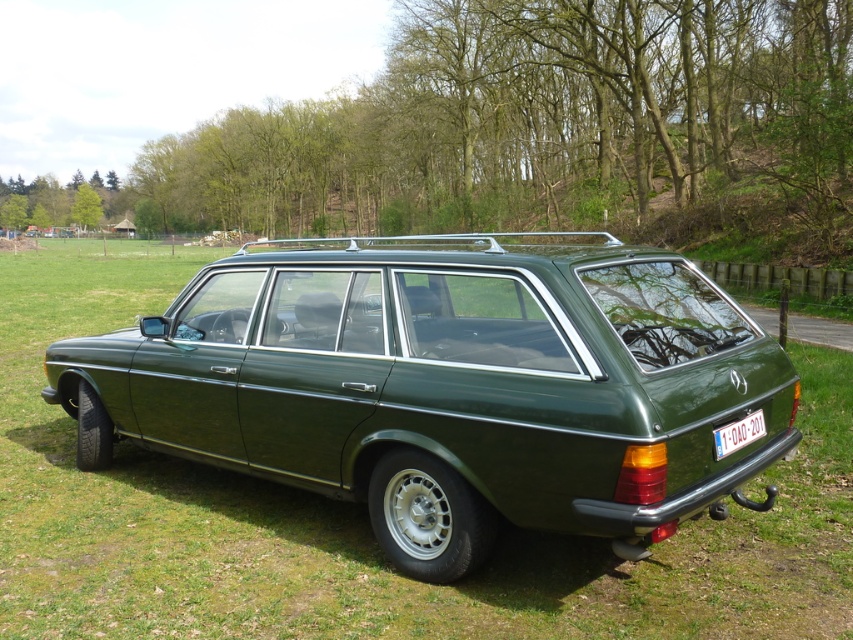
Question: Which point is closer to the camera?

Choices:
 (A) (242, 369)
 (B) (724, 444)

Answer: (B)

Question: Which point is closer to the camera?

Choices:
 (A) white plastic license plate at lower right
 (B) green matte station wagon at center

Answer: (B)

Question: Is green matte station wagon at center thinner than white plastic license plate at lower right?

Choices:
 (A) yes
 (B) no

Answer: (B)

Question: Which point is farther to the camera?

Choices:
 (A) white plastic license plate at lower right
 (B) green matte station wagon at center

Answer: (A)

Question: Is green matte station wagon at center wider than white plastic license plate at lower right?

Choices:
 (A) no
 (B) yes

Answer: (B)

Question: From the image, what is the correct spatial relationship of green matte station wagon at center in relation to white plastic license plate at lower right?

Choices:
 (A) left
 (B) right

Answer: (A)